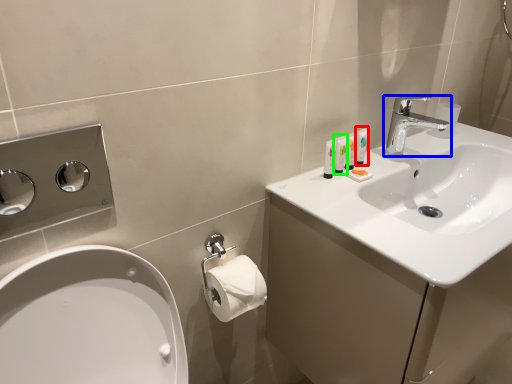
Question: Based on their relative distances, which object is farther from mouthwash (highlighted by a red box)? Choose from tap (highlighted by a blue box) and mouthwash (highlighted by a green box).

Choices:
 (A) tap
 (B) mouthwash

Answer: (A)